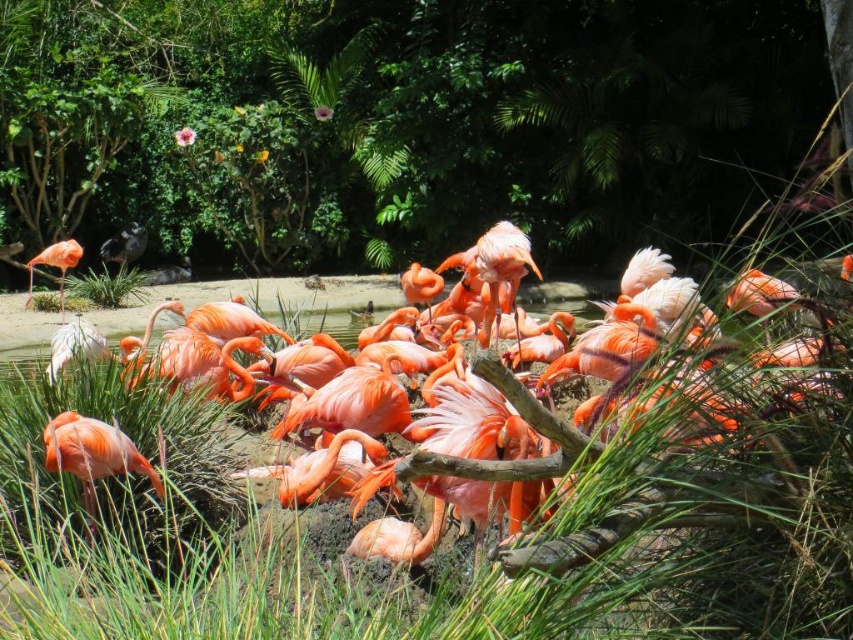
Can you confirm if green leafy tree at upper center is shorter than matte gray bird at left?

Incorrect, green leafy tree at upper center's height does not fall short of matte gray bird at left's.

In the scene shown: Is green leafy tree at upper center positioned behind matte gray bird at left?

No, green leafy tree at upper center is closer to the viewer.

Which is in front, point (309, 104) or point (120, 244)?

Point (120, 244) is in front.

The width and height of the screenshot is (853, 640). What are the coordinates of `green leafy tree at upper center` in the screenshot? It's located at (416, 118).

Between white matte bird at lower left and matte gray bird at left, which one has more height?

With more height is matte gray bird at left.

Does white matte bird at lower left have a lesser height compared to matte gray bird at left?

Yes, white matte bird at lower left is shorter than matte gray bird at left.

Between point (68, 349) and point (125, 234), which one is positioned in front?

Point (68, 349) is more forward.

Where is `white matte bird at lower left`? The height and width of the screenshot is (640, 853). white matte bird at lower left is located at coordinates (74, 344).

From the picture: Can you confirm if white matte bird at lower left is wider than matte pink flamingo at left?

Correct, the width of white matte bird at lower left exceeds that of matte pink flamingo at left.

Between point (103, 346) and point (28, 291), which one is positioned in front?

Point (103, 346) is in front.

In order to click on white matte bird at lower left in this screenshot , I will do `click(74, 344)`.